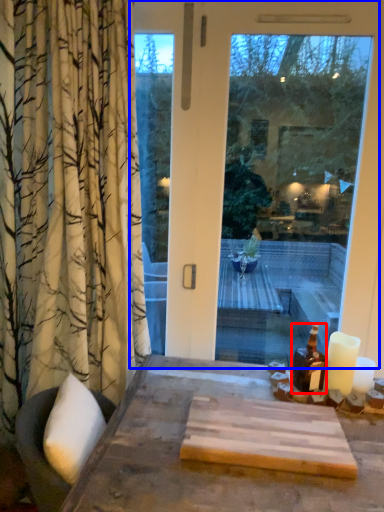
Question: Which object is closer to the camera taking this photo, bottle (highlighted by a red box) or window (highlighted by a blue box)?

Choices:
 (A) bottle
 (B) window

Answer: (A)